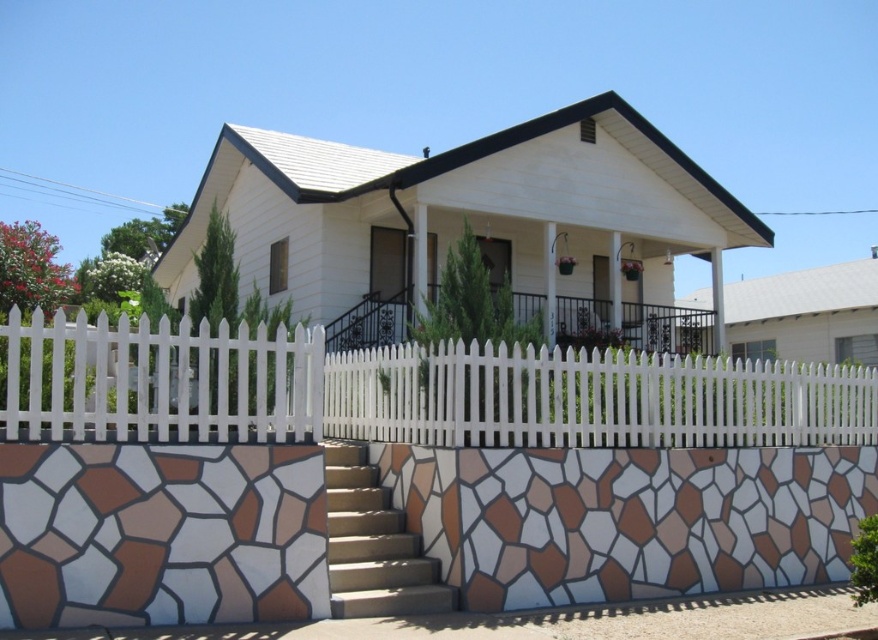
You are standing in front of the house and want to enter through the front door. The white picket fence at left and brown stone stairs at lower left are in your way. Which obstacle should you move around first to reach the door?

You should move around the white picket fence at left first because it is in front of the brown stone stairs at lower left, meaning the fence is closer to you and blocking your path before the stairs.

From the picture: You are a painter who needs to decide whether to paint the white picket fence at lower center or the brown stone stairs at lower left first. Since you want to start with the wider structure, which one should you choose?

The white picket fence at lower center is wider than the brown stone stairs at lower left, so you should paint the white picket fence at lower center first.

You are standing in front of the house and want to enter through the front door. The white picket fence at left and brown stone stairs at lower left are in your path. Which object must you go around or over to reach the door?

The white picket fence at left is positioned over the brown stone stairs at lower left, so you must go around the white picket fence at left to reach the front door.